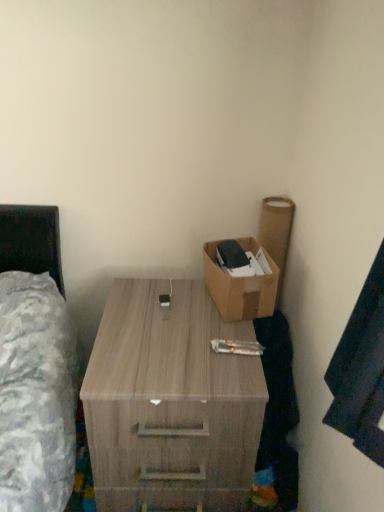
Question: Considering the relative sizes of brown cardboard box at upper right and wooden desk at center in the image provided, is brown cardboard box at upper right wider than wooden desk at center?

Choices:
 (A) no
 (B) yes

Answer: (A)

Question: From a real-world perspective, does brown cardboard box at upper right sit lower than wooden desk at center?

Choices:
 (A) yes
 (B) no

Answer: (B)

Question: From the image's perspective, would you say brown cardboard box at upper right is positioned over wooden desk at center?

Choices:
 (A) yes
 (B) no

Answer: (A)

Question: Is brown cardboard box at upper right to the right of wooden desk at center from the viewer's perspective?

Choices:
 (A) no
 (B) yes

Answer: (B)

Question: Would you say brown cardboard box at upper right is outside wooden desk at center?

Choices:
 (A) no
 (B) yes

Answer: (B)

Question: Does brown cardboard box at upper right have a larger size compared to wooden desk at center?

Choices:
 (A) yes
 (B) no

Answer: (B)

Question: Is wooden desk at center oriented towards brown cardboard box at upper right?

Choices:
 (A) no
 (B) yes

Answer: (A)

Question: Is brown cardboard box at upper right a part of wooden desk at center?

Choices:
 (A) yes
 (B) no

Answer: (B)

Question: Can you confirm if wooden desk at center is taller than brown cardboard box at upper right?

Choices:
 (A) yes
 (B) no

Answer: (A)

Question: Can you confirm if wooden desk at center is bigger than brown cardboard box at upper right?

Choices:
 (A) yes
 (B) no

Answer: (A)

Question: From a real-world perspective, is wooden desk at center below brown cardboard box at upper right?

Choices:
 (A) no
 (B) yes

Answer: (B)

Question: Is wooden desk at center smaller than brown cardboard box at upper right?

Choices:
 (A) no
 (B) yes

Answer: (A)

Question: In terms of width, does wooden desk at center look wider or thinner when compared to brown cardboard box at upper right?

Choices:
 (A) wide
 (B) thin

Answer: (A)